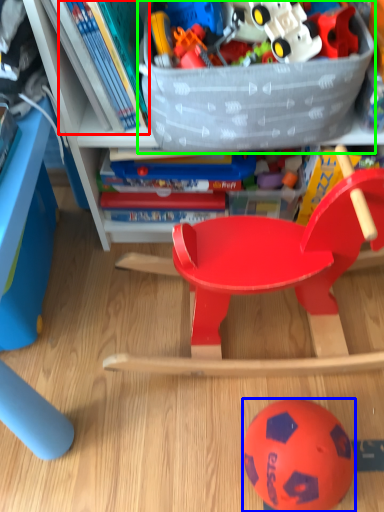
Question: Considering the real-world distances, which object is farthest from book (highlighted by a red box)? ball (highlighted by a blue box) or storage box (highlighted by a green box)?

Choices:
 (A) ball
 (B) storage box

Answer: (A)